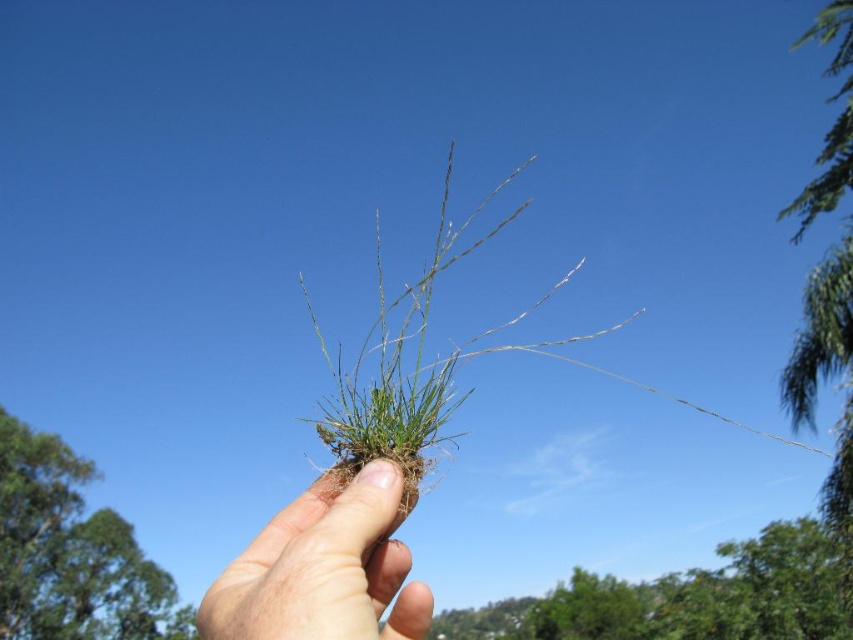
Question: Which object is positioned farthest from the flesh-toned skin at center?

Choices:
 (A) green leafy tree at lower right
 (B) green leafy tree at upper left

Answer: (B)

Question: Does green leafy tree at lower right have a smaller size compared to flesh-toned skin at center?

Choices:
 (A) yes
 (B) no

Answer: (B)

Question: Is green leafy tree at lower right above green leafy tree at upper left?

Choices:
 (A) no
 (B) yes

Answer: (A)

Question: Which of these objects is positioned closest to the flesh-toned skin at center?

Choices:
 (A) green leafy tree at lower right
 (B) green leafy tree at upper left

Answer: (A)

Question: Which point appears farthest from the camera in this image?

Choices:
 (A) (16, 435)
 (B) (283, 518)
 (C) (798, 577)

Answer: (A)

Question: Can you confirm if green leafy tree at lower right is positioned to the right of green leafy tree at upper left?

Choices:
 (A) no
 (B) yes

Answer: (B)